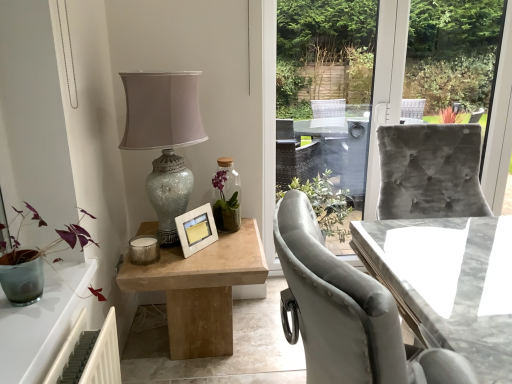
Question: Is purple matte plant at left at the left side of crackle glass lampshade at upper left?

Choices:
 (A) yes
 (B) no

Answer: (A)

Question: Can you confirm if purple matte plant at left is positioned to the right of crackle glass lampshade at upper left?

Choices:
 (A) yes
 (B) no

Answer: (B)

Question: Is purple matte plant at left oriented away from crackle glass lampshade at upper left?

Choices:
 (A) yes
 (B) no

Answer: (B)

Question: Does purple matte plant at left have a lesser height compared to crackle glass lampshade at upper left?

Choices:
 (A) no
 (B) yes

Answer: (B)

Question: Could you tell me if purple matte plant at left is turned towards crackle glass lampshade at upper left?

Choices:
 (A) no
 (B) yes

Answer: (A)

Question: Can you confirm if purple matte plant at left is smaller than crackle glass lampshade at upper left?

Choices:
 (A) yes
 (B) no

Answer: (A)

Question: Does white matte picture frame at center come in front of crackle glass lampshade at upper left?

Choices:
 (A) no
 (B) yes

Answer: (A)

Question: Is white matte picture frame at center not within crackle glass lampshade at upper left?

Choices:
 (A) no
 (B) yes

Answer: (A)

Question: Does white matte picture frame at center have a greater height compared to crackle glass lampshade at upper left?

Choices:
 (A) no
 (B) yes

Answer: (A)

Question: From the image's perspective, does white matte picture frame at center appear lower than crackle glass lampshade at upper left?

Choices:
 (A) no
 (B) yes

Answer: (B)

Question: Does white matte picture frame at center have a smaller size compared to crackle glass lampshade at upper left?

Choices:
 (A) no
 (B) yes

Answer: (B)

Question: From a real-world perspective, is white matte picture frame at center below crackle glass lampshade at upper left?

Choices:
 (A) no
 (B) yes

Answer: (B)

Question: Would you say purple matte plant at left contains natural wood table at center, arranged as the 1th table when viewed from the left?

Choices:
 (A) no
 (B) yes

Answer: (A)